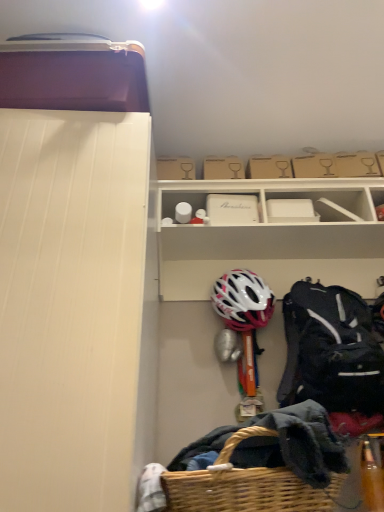
The image size is (384, 512). Identify the location of woven brown picnic basket at lower center. (246, 485).

Where is `black synthetic backpack at right`? black synthetic backpack at right is located at coordinates (331, 350).

You are a GUI agent. You are given a task and a screenshot of the screen. Output one action in this format:
    pyautogui.click(x=<x>, y=<y>)
    Task: Click on the white plastic shelf at upper center
    This screenshot has height=512, width=384.
    Given the screenshot: What is the action you would take?
    pyautogui.click(x=271, y=239)

Considering the sizes of white matte storage box at upper center, the first storage box when ordered from bottom to top, and white matte helmet at center in the image, is white matte storage box at upper center, the first storage box when ordered from bottom to top, taller or shorter than white matte helmet at center?

white matte storage box at upper center, the first storage box when ordered from bottom to top, is shorter than white matte helmet at center.

Which is closer to the camera, (x=226, y=219) or (x=236, y=289)?

Point (x=236, y=289)

From a real-world perspective, who is located higher, white matte storage box at upper center, the first storage box when ordered from bottom to top, or white matte helmet at center?

white matte storage box at upper center, the first storage box when ordered from bottom to top, from a real-world perspective.

From the image's perspective, between white matte storage box at upper center, the second storage box positioned from the top, and white matte helmet at center, who is located below?

white matte helmet at center is shown below in the image.

From the image's perspective, is woven brown picnic basket at lower center located beneath brown cardboard box at upper center, which is the 1th storage box in top-to-bottom order?

Indeed, from the image's perspective, woven brown picnic basket at lower center is shown beneath brown cardboard box at upper center, which is the 1th storage box in top-to-bottom order.

From a real-world perspective, which is physically below, woven brown picnic basket at lower center or brown cardboard box at upper center, which is the 1th storage box in top-to-bottom order?

woven brown picnic basket at lower center, from a real-world perspective.

From a real-world perspective, starting from the woven brown picnic basket at lower center, which storage box is the 2nd one vertically above it? Please provide its 2D coordinates.

[(223, 168)]

From a real-world perspective, is black synthetic backpack at right physically below woven brown picnic basket at lower center?

Incorrect, from a real-world perspective, black synthetic backpack at right is higher than woven brown picnic basket at lower center.

From the image's perspective, is black synthetic backpack at right located above or below woven brown picnic basket at lower center?

black synthetic backpack at right is above woven brown picnic basket at lower center.

Looking at the image, does black synthetic backpack at right seem bigger or smaller compared to woven brown picnic basket at lower center?

black synthetic backpack at right is bigger than woven brown picnic basket at lower center.

Is woven brown picnic basket at lower center surrounded by black synthetic backpack at right?

No, black synthetic backpack at right does not contain woven brown picnic basket at lower center.

Which of these two, black synthetic backpack at right or white matte storage box at upper center, the first storage box when ordered from bottom to top, is bigger?

black synthetic backpack at right.

From the picture: Between black synthetic backpack at right and white matte storage box at upper center, the first storage box when ordered from bottom to top, which one appears on the left side from the viewer's perspective?

white matte storage box at upper center, the first storage box when ordered from bottom to top, is more to the left.

Can you confirm if black synthetic backpack at right is taller than white matte storage box at upper center, the first storage box when ordered from bottom to top?

Indeed, black synthetic backpack at right has a greater height compared to white matte storage box at upper center, the first storage box when ordered from bottom to top.

From a real-world perspective, which object stands above the other?

In real-world perspective, white matte storage box at upper center, the first storage box when ordered from bottom to top, is above.

Can you tell me how much white matte helmet at center and brown cardboard box at upper center, which is the 1th storage box in top-to-bottom order, differ in facing direction?

3.22 degrees separate the facing orientations of white matte helmet at center and brown cardboard box at upper center, which is the 1th storage box in top-to-bottom order.

Is white matte helmet at center spatially inside brown cardboard box at upper center, which is the 2th storage box in bottom-to-top order, or outside of it?

The correct answer is: outside.

From a real-world perspective, which is physically below, white matte helmet at center or brown cardboard box at upper center, which is the 1th storage box in top-to-bottom order?

From a 3D spatial view, white matte helmet at center is below.

Considering the sizes of objects brown cardboard box at upper center, which is the 1th storage box in top-to-bottom order, and white matte storage box at upper center, the second storage box positioned from the top, in the image provided, who is wider, brown cardboard box at upper center, which is the 1th storage box in top-to-bottom order, or white matte storage box at upper center, the second storage box positioned from the top,?

white matte storage box at upper center, the second storage box positioned from the top, is wider.

Which of these two, brown cardboard box at upper center, which is the 1th storage box in top-to-bottom order, or white matte storage box at upper center, the first storage box when ordered from bottom to top, is smaller?

brown cardboard box at upper center, which is the 1th storage box in top-to-bottom order, is smaller.

Is brown cardboard box at upper center, which is the 2th storage box in bottom-to-top order, oriented away from white matte storage box at upper center, the first storage box when ordered from bottom to top?

No, brown cardboard box at upper center, which is the 2th storage box in bottom-to-top order,'s orientation is not away from white matte storage box at upper center, the first storage box when ordered from bottom to top.

From the image's perspective, relative to white matte storage box at upper center, the first storage box when ordered from bottom to top, is brown cardboard box at upper center, which is the 2th storage box in bottom-to-top order, above or below?

Clearly, from the image's perspective, brown cardboard box at upper center, which is the 2th storage box in bottom-to-top order, is above white matte storage box at upper center, the first storage box when ordered from bottom to top.

Is white plastic shelf at upper center not inside white matte storage box at upper center, the second storage box positioned from the top?

Yes, white plastic shelf at upper center is outside of white matte storage box at upper center, the second storage box positioned from the top.

Looking at this image, considering the sizes of white plastic shelf at upper center and white matte storage box at upper center, the second storage box positioned from the top, in the image, is white plastic shelf at upper center wider or thinner than white matte storage box at upper center, the second storage box positioned from the top,?

Considering their sizes, white plastic shelf at upper center looks broader than white matte storage box at upper center, the second storage box positioned from the top.

Does white plastic shelf at upper center touch white matte storage box at upper center, the first storage box when ordered from bottom to top?

No, white plastic shelf at upper center is not with white matte storage box at upper center, the first storage box when ordered from bottom to top.

Can you confirm if white plastic shelf at upper center is taller than white matte storage box at upper center, the second storage box positioned from the top?

Yes.

Starting from the white matte helmet at center, which storage box is the 1st one behind? Please provide its 2D coordinates.

[(232, 209)]

Find the location of a particular element. This screenshot has height=512, width=384. picnic basket on the right of brown cardboard box at upper center, which is the 2th storage box in bottom-to-top order is located at coordinates (246, 485).

Which object lies nearer to the anchor point white matte storage box at upper center, the second storage box positioned from the top, woven brown picnic basket at lower center or black synthetic backpack at right?

The object closer to white matte storage box at upper center, the second storage box positioned from the top, is black synthetic backpack at right.

Considering their positions, is woven brown picnic basket at lower center positioned closer to black synthetic backpack at right than white matte storage box at upper center, the first storage box when ordered from bottom to top?

white matte storage box at upper center, the first storage box when ordered from bottom to top, is positioned closer to the anchor black synthetic backpack at right.

Looking at the image, which one is located closer to woven brown picnic basket at lower center, black synthetic backpack at right or white plastic shelf at upper center?

The object closer to woven brown picnic basket at lower center is black synthetic backpack at right.

Based on their spatial positions, is white plastic shelf at upper center or brown cardboard box at upper center, which is the 1th storage box in top-to-bottom order, further from black synthetic backpack at right?

The object further to black synthetic backpack at right is brown cardboard box at upper center, which is the 1th storage box in top-to-bottom order.

Estimate the real-world distances between objects in this image. Which object is further from woven brown picnic basket at lower center, black synthetic backpack at right or brown cardboard box at upper center, which is the 1th storage box in top-to-bottom order?

The object further to woven brown picnic basket at lower center is brown cardboard box at upper center, which is the 1th storage box in top-to-bottom order.

Estimate the real-world distances between objects in this image. Which object is further from woven brown picnic basket at lower center, brown cardboard box at upper center, which is the 1th storage box in top-to-bottom order, or white matte storage box at upper center, the second storage box positioned from the top?

brown cardboard box at upper center, which is the 1th storage box in top-to-bottom order, lies further to woven brown picnic basket at lower center than the other object.

When comparing their distances from black synthetic backpack at right, does brown cardboard box at upper center, which is the 2th storage box in bottom-to-top order, or white matte helmet at center seem further?

Based on the image, brown cardboard box at upper center, which is the 2th storage box in bottom-to-top order, appears to be further to black synthetic backpack at right.

From the image, which object appears to be nearer to black synthetic backpack at right, woven brown picnic basket at lower center or white matte helmet at center?

white matte helmet at center.

At what (x,y) coordinates should I click in order to perform the action: click on storage box between brown cardboard box at upper center, which is the 2th storage box in bottom-to-top order, and black synthetic backpack at right in the up-down direction. Please return your answer as a coordinate pair (x, y). Looking at the image, I should click on (232, 209).

Locate an element on the screen. The width and height of the screenshot is (384, 512). helmet between woven brown picnic basket at lower center and brown cardboard box at upper center, which is the 2th storage box in bottom-to-top order, in the front-back direction is located at coordinates (243, 300).

Locate an element on the screen. helmet between black synthetic backpack at right and white matte storage box at upper center, the first storage box when ordered from bottom to top, from front to back is located at coordinates (243, 300).

I want to click on helmet between brown cardboard box at upper center, which is the 2th storage box in bottom-to-top order, and black synthetic backpack at right vertically, so click(243, 300).